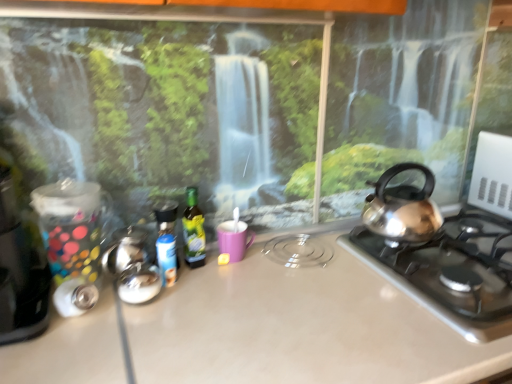
Question: Should I look upward or downward to see satin silver gas stove at right?

Choices:
 (A) down
 (B) up

Answer: (A)

Question: Can you confirm if metallic silver canister at left is wider than satin silver gas stove at right?

Choices:
 (A) no
 (B) yes

Answer: (A)

Question: From a real-world perspective, is metallic silver canister at left on satin silver gas stove at right?

Choices:
 (A) no
 (B) yes

Answer: (B)

Question: Can we say metallic silver canister at left lies outside satin silver gas stove at right?

Choices:
 (A) yes
 (B) no

Answer: (A)

Question: Can you confirm if metallic silver canister at left is smaller than satin silver gas stove at right?

Choices:
 (A) no
 (B) yes

Answer: (B)

Question: Considering the relative sizes of metallic silver canister at left and satin silver gas stove at right in the image provided, is metallic silver canister at left bigger than satin silver gas stove at right?

Choices:
 (A) no
 (B) yes

Answer: (A)

Question: Does metallic silver canister at left turn towards satin silver gas stove at right?

Choices:
 (A) no
 (B) yes

Answer: (A)

Question: Can you confirm if matte beige countertop at center is taller than metallic silver canister at left?

Choices:
 (A) no
 (B) yes

Answer: (B)

Question: Does matte beige countertop at center have a greater width compared to metallic silver canister at left?

Choices:
 (A) yes
 (B) no

Answer: (A)

Question: Can you confirm if matte beige countertop at center is positioned to the right of metallic silver canister at left?

Choices:
 (A) yes
 (B) no

Answer: (A)

Question: Is metallic silver canister at left at the back of matte beige countertop at center?

Choices:
 (A) no
 (B) yes

Answer: (A)

Question: Considering the relative positions of matte beige countertop at center and metallic silver canister at left in the image provided, is matte beige countertop at center in front of metallic silver canister at left?

Choices:
 (A) no
 (B) yes

Answer: (B)

Question: Is metallic silver canister at left a part of matte beige countertop at center?

Choices:
 (A) no
 (B) yes

Answer: (A)

Question: Can you confirm if metallic silver canister at left is positioned to the left of green glass bottle at center, the 2th bottle in the left-to-right sequence?

Choices:
 (A) no
 (B) yes

Answer: (B)